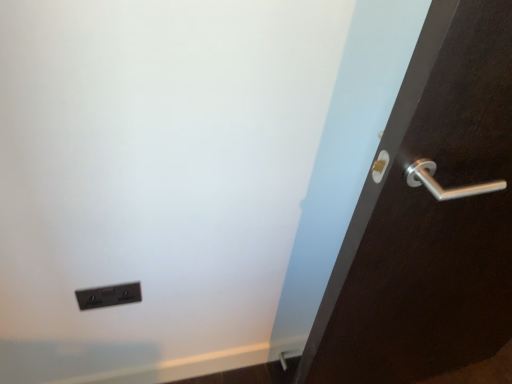
What is the approximate height of black plastic socket at lower left?

The height of black plastic socket at lower left is 3.46 inches.

Identify the location of black plastic socket at lower left. [109, 296].

The width and height of the screenshot is (512, 384). What do you see at coordinates (109, 296) in the screenshot?
I see `black plastic socket at lower left` at bounding box center [109, 296].

Locate an element on the screen. Image resolution: width=512 pixels, height=384 pixels. black plastic socket at lower left is located at coordinates (109, 296).